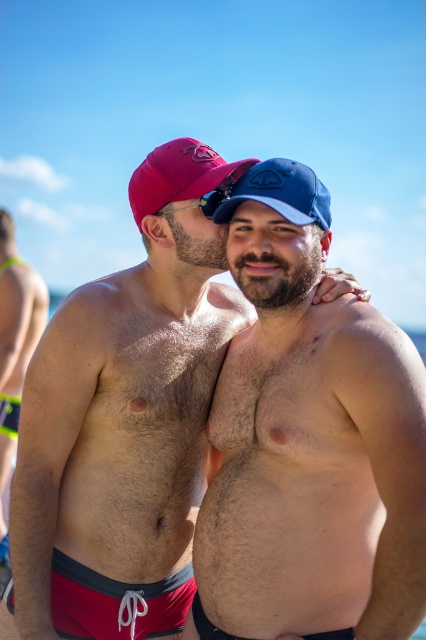
Question: Is red fabric shorts at lower left below matte red baseball cap at upper center?

Choices:
 (A) yes
 (B) no

Answer: (A)

Question: Which of the following is the closest to the observer?

Choices:
 (A) matte red swim trunks at center
 (B) red fabric shorts at lower left
 (C) matte red baseball cap at upper center

Answer: (A)

Question: Which of the following is the farthest from the observer?

Choices:
 (A) black rubber goggles at center
 (B) blue fabric baseball cap at upper center
 (C) neon green swim trunks at left
 (D) red fabric shorts at lower left

Answer: (C)

Question: In this image, where is red fabric shorts at lower left located relative to blue fabric baseball cap at upper center?

Choices:
 (A) right
 (B) left

Answer: (B)

Question: Which point is closer to the camera taking this photo?

Choices:
 (A) (342, 531)
 (B) (2, 472)

Answer: (A)

Question: Observing the image, what is the correct spatial positioning of red fabric shorts at lower left in reference to matte red baseball cap at upper center?

Choices:
 (A) above
 (B) below

Answer: (B)